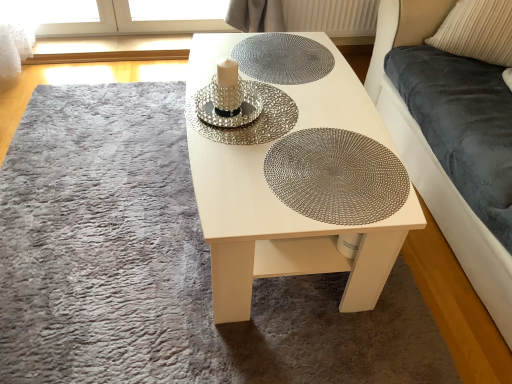
What are the coordinates of `vacant space behind metallic woven placemat at center, marked as the 1th glass plate in a bottom-to-top arrangement` in the screenshot? It's located at (336, 106).